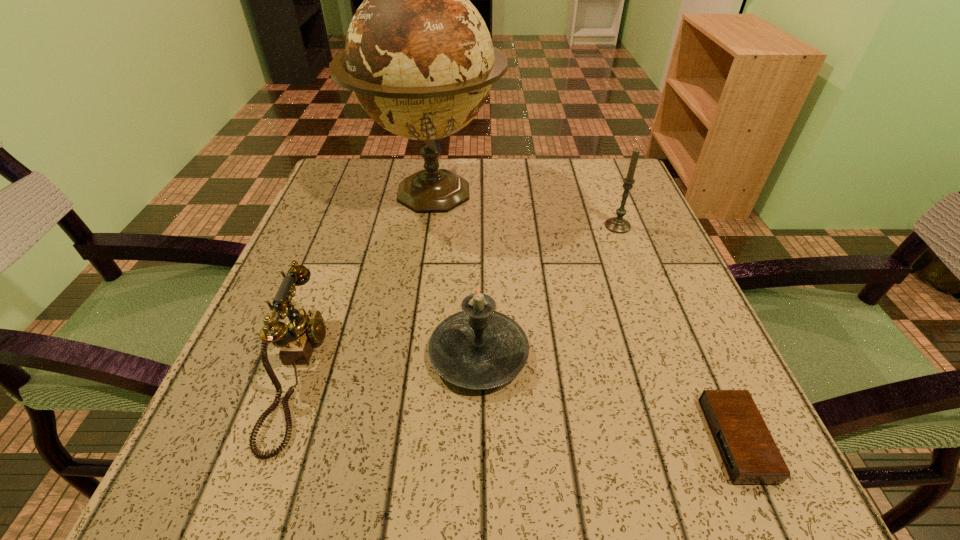
This screenshot has width=960, height=540. What are the coordinates of `free space located on the front-facing side of the telephone` in the screenshot? It's located at (423, 373).

Find the location of a particular element. The image size is (960, 540). blank space located 0.370m on the front face of the shortest object is located at coordinates (433, 440).

Locate an element on the screen. This screenshot has height=540, width=960. vacant space situated 0.240m on the front face of the shortest object is located at coordinates (532, 440).

At what (x,y) coordinates should I click in order to perform the action: click on blank space located on the front face of the shortest object. Please return your answer as a coordinate pair (x, y). The width and height of the screenshot is (960, 540). Looking at the image, I should click on pyautogui.click(x=464, y=440).

Locate an element on the screen. object situated at the far edge is located at coordinates pos(419,58).

Locate an element on the screen. telephone present at the near edge is located at coordinates (297, 339).

This screenshot has width=960, height=540. I want to click on alarm clock that is at the near edge, so click(x=750, y=455).

Identify the location of globe located in the left edge section of the desktop. The width and height of the screenshot is (960, 540). (419, 58).

This screenshot has height=540, width=960. I want to click on telephone positioned at the left edge, so click(297, 339).

Locate an element on the screen. The height and width of the screenshot is (540, 960). candle at the right edge is located at coordinates (617, 224).